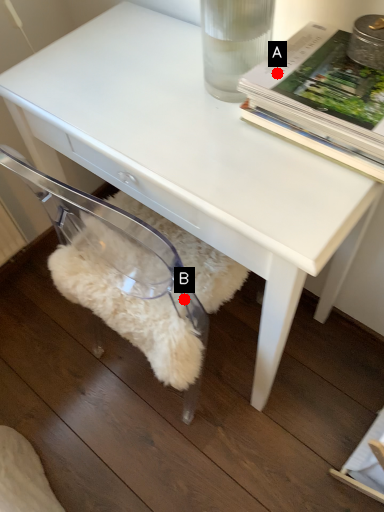
Question: Two points are circled on the image, labeled by A and B beside each circle. Which of the following is the closest to the observer?

Choices:
 (A) A is closer
 (B) B is closer

Answer: (A)